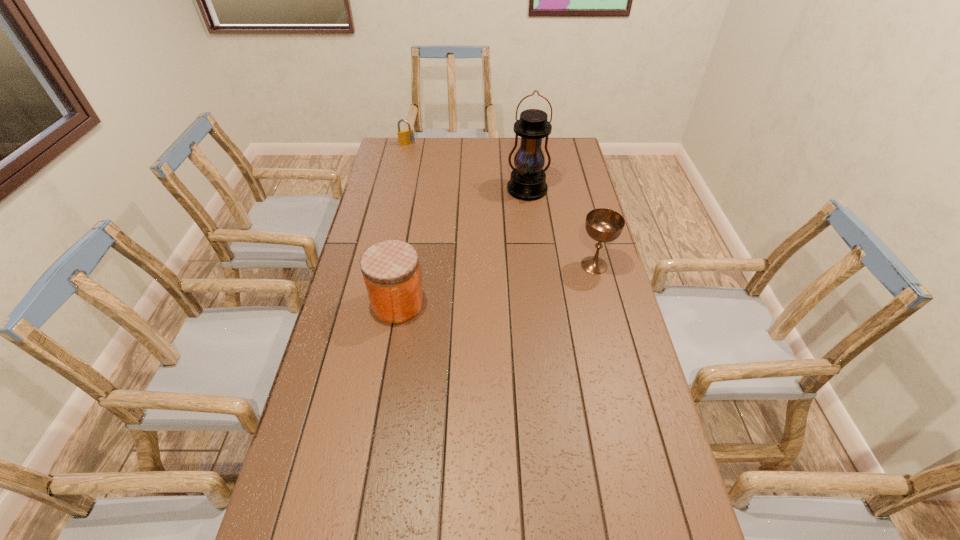
Find several locations within vacant space located above the lantern, indicating its light source. Please provide its 2D coordinates. Your answer should be formatted as a tuple, i.e. [(x, y)], where the tuple contains the x and y coordinates of a point satisfying the conditions above.

[(524, 244)]

Where can I find a free point located above the lantern, indicating its light source? Please provide its 2D coordinates. Your answer should be formatted as a tuple, i.e. [(x, y)], where the tuple contains the x and y coordinates of a point satisfying the conditions above.

[(523, 253)]

Where is `free point located 0.190m on the side with the combination dials of the padlock`? free point located 0.190m on the side with the combination dials of the padlock is located at coordinates [x=420, y=167].

You are a GUI agent. You are given a task and a screenshot of the screen. Output one action in this format:
    pyautogui.click(x=<x>, y=<y>)
    Task: Click on the vacant space located 0.130m on the side with the combination dials of the padlock
    This screenshot has width=960, height=540.
    Given the screenshot: What is the action you would take?
    pyautogui.click(x=417, y=160)

At what (x,y) coordinates should I click in order to perform the action: click on blank area located 0.150m on the side with the combination dials of the padlock. Please return your answer as a coordinate pair (x, y). The height and width of the screenshot is (540, 960). Looking at the image, I should click on (418, 163).

Identify the location of object positioned at the far edge. The image size is (960, 540). (405, 137).

In order to click on jar situated at the left edge in this screenshot , I will do `click(390, 268)`.

Locate an element on the screen. This screenshot has width=960, height=540. padlock that is at the left edge is located at coordinates (405, 137).

The height and width of the screenshot is (540, 960). In order to click on object situated at the right edge in this screenshot , I will do `click(604, 225)`.

Find the location of a particular element. object that is at the far left corner is located at coordinates (405, 137).